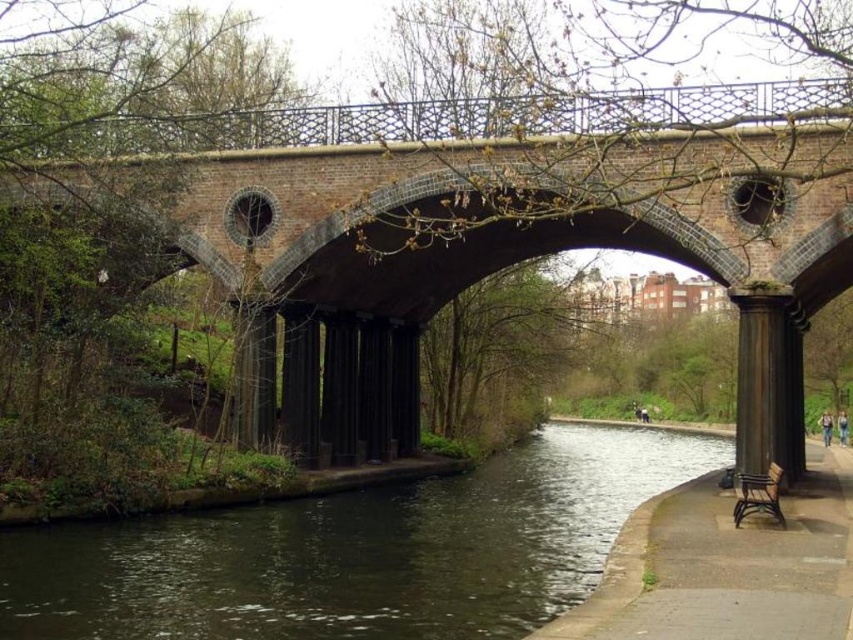
Is brick arch bridge at center taller than smooth concrete path at lower right?

Correct, brick arch bridge at center is much taller as smooth concrete path at lower right.

Who is taller, brick arch bridge at center or smooth concrete path at lower right?

brick arch bridge at center

Measure the distance between point (735, 172) and camera.

Point (735, 172) is 52.83 meters from camera.

Find the location of a particular element. The height and width of the screenshot is (640, 853). brick arch bridge at center is located at coordinates (485, 220).

Is smooth concrete path at lower right further to the viewer compared to rustic wood bench at lower right?

That is False.

Who is lower down, smooth concrete path at lower right or rustic wood bench at lower right?

Positioned lower is smooth concrete path at lower right.

Between point (653, 561) and point (747, 477), which one is positioned in front?

Point (653, 561) is in front.

At what (x,y) coordinates should I click in order to perform the action: click on smooth concrete path at lower right. Please return your answer as a coordinate pair (x, y). Image resolution: width=853 pixels, height=640 pixels. Looking at the image, I should click on (724, 568).

Image resolution: width=853 pixels, height=640 pixels. What do you see at coordinates (767, 385) in the screenshot?
I see `black polished stone column at right` at bounding box center [767, 385].

Is point (762, 301) closer to viewer compared to point (763, 477)?

No, it is not.

Is point (746, 348) in front of point (759, 508)?

That is False.

Locate an element on the screen. black polished stone column at right is located at coordinates (767, 385).